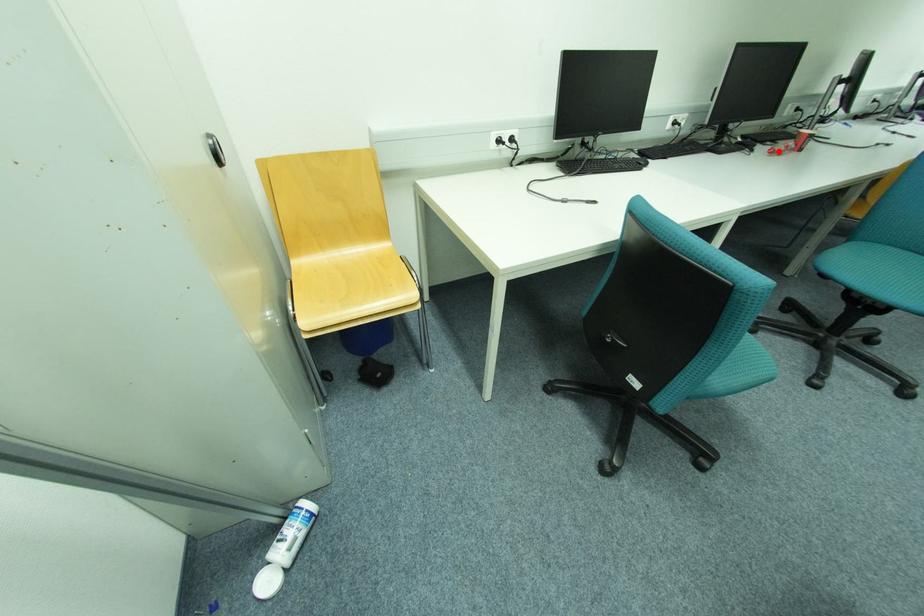
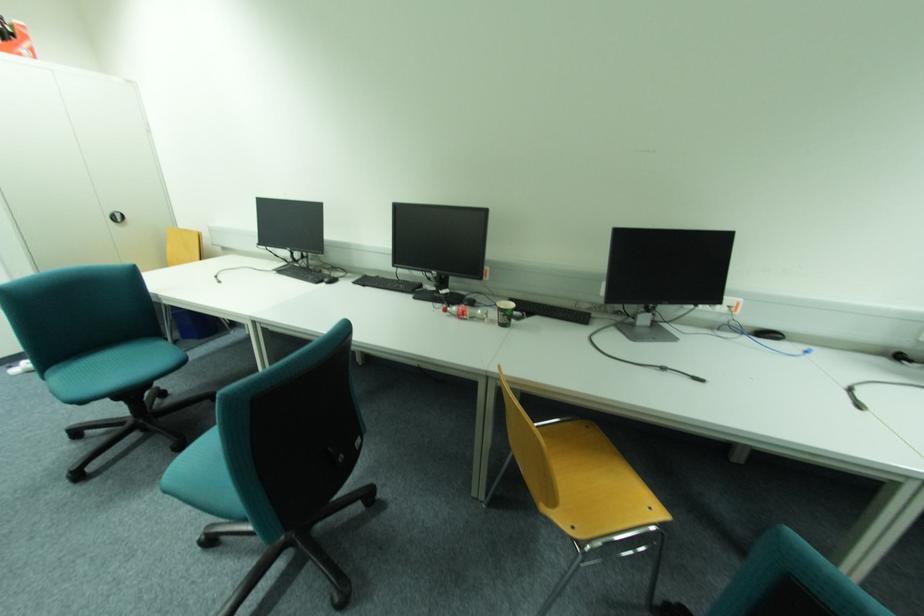
The point at the highlighted location is marked in the first image. Where is the corresponding point in the second image?

(451, 310)